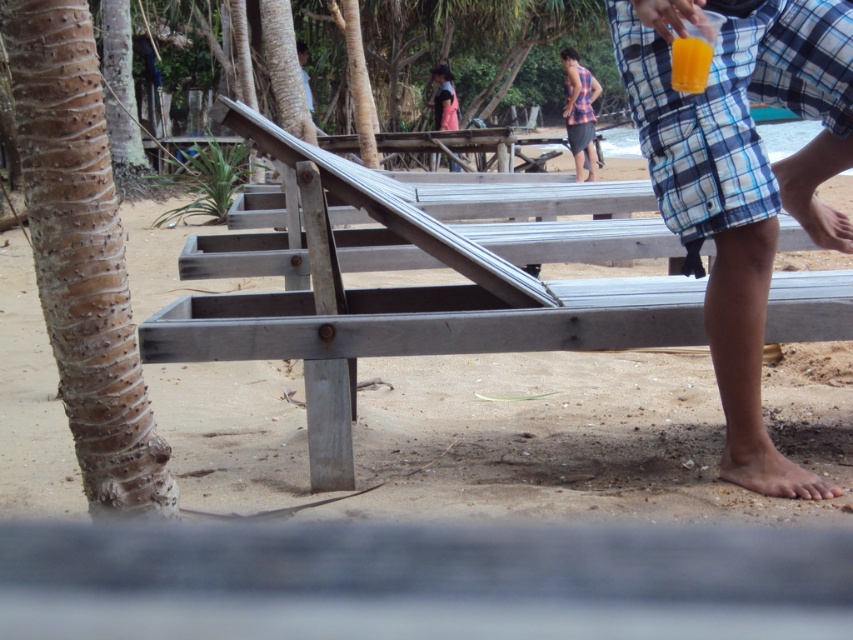
How distant is brown rough bark palm tree at left from plaid fabric shirt at upper right?

A distance of 15.46 meters exists between brown rough bark palm tree at left and plaid fabric shirt at upper right.

Can you confirm if brown rough bark palm tree at left is bigger than plaid fabric shirt at upper right?

No, brown rough bark palm tree at left is not bigger than plaid fabric shirt at upper right.

You are a GUI agent. You are given a task and a screenshot of the screen. Output one action in this format:
    pyautogui.click(x=<x>, y=<y>)
    Task: Click on the brown rough bark palm tree at left
    
    Given the screenshot: What is the action you would take?
    pyautogui.click(x=82, y=257)

Find the location of a particular element. This screenshot has height=640, width=853. brown rough bark palm tree at left is located at coordinates (82, 257).

Does point (740, 173) lie in front of point (699, 84)?

No, it is behind (699, 84).

Is blue plaid shorts at lower right in front of translucent plastic cup at upper right?

That is True.

Measure the distance between blue plaid shorts at lower right and camera.

They are 2.76 meters apart.

The width and height of the screenshot is (853, 640). In order to click on blue plaid shorts at lower right in this screenshot , I will do `click(741, 179)`.

Between smooth wooden bench at center and translucent plastic cup at upper right, which one is positioned higher?

smooth wooden bench at center is above.

Is smooth wooden bench at center to the right of translucent plastic cup at upper right from the viewer's perspective?

Yes, smooth wooden bench at center is to the right of translucent plastic cup at upper right.

Find the location of `smooth wooden bench at center`. smooth wooden bench at center is located at coordinates (587, 435).